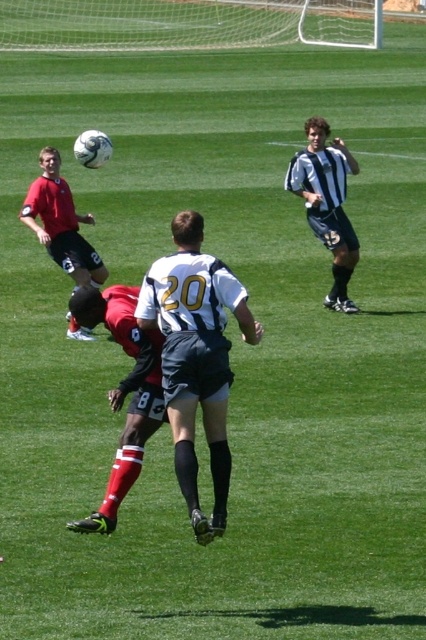
Consider the image. You are a referee observing the soccer match. You notice two players at the center of the field. One is the red matte soccer player at center, and the other is the striped jersey at center. Which player is positioned lower on the field?

The red matte soccer player at center is positioned below the striped jersey at center, so the red matte soccer player at center is lower on the field.

You are a soccer coach analyzing the field positioning. Which object is wider, the red matte soccer player at center or the matte red shirt at left?

The matte red shirt at left is wider than the red matte soccer player at center.

You are a soccer coach observing the match. You notice the red matte soccer player at center and the striped jersey at center. How far apart are these two players from each other?

The red matte soccer player at center is 15.95 feet away from the striped jersey at center.